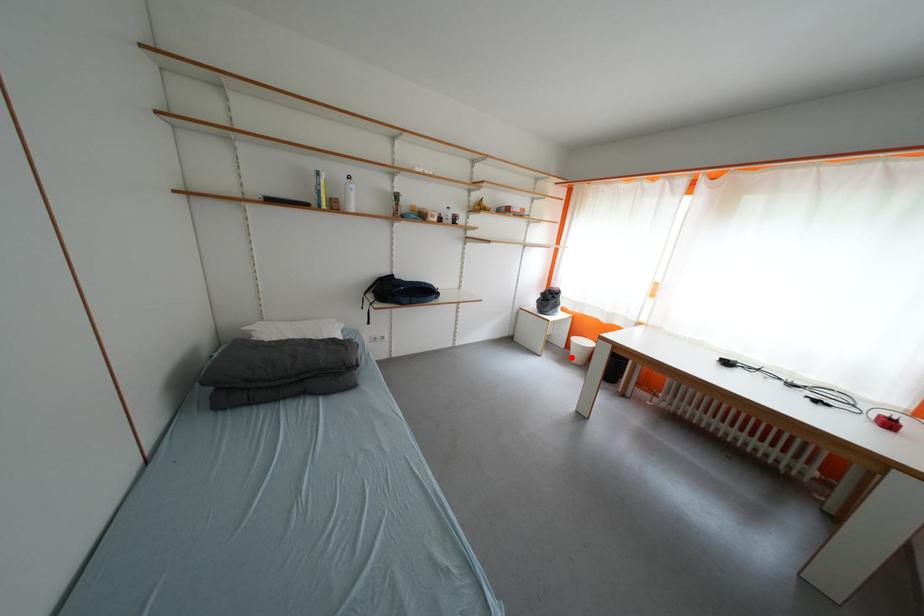
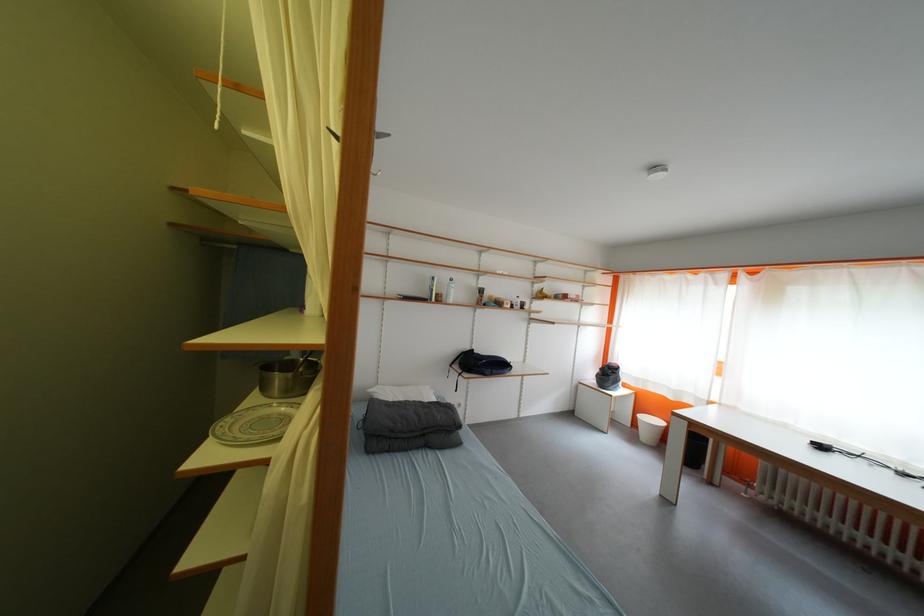
Where in the second image is the point corresponding to the highlighted location from the first image?

(639, 436)